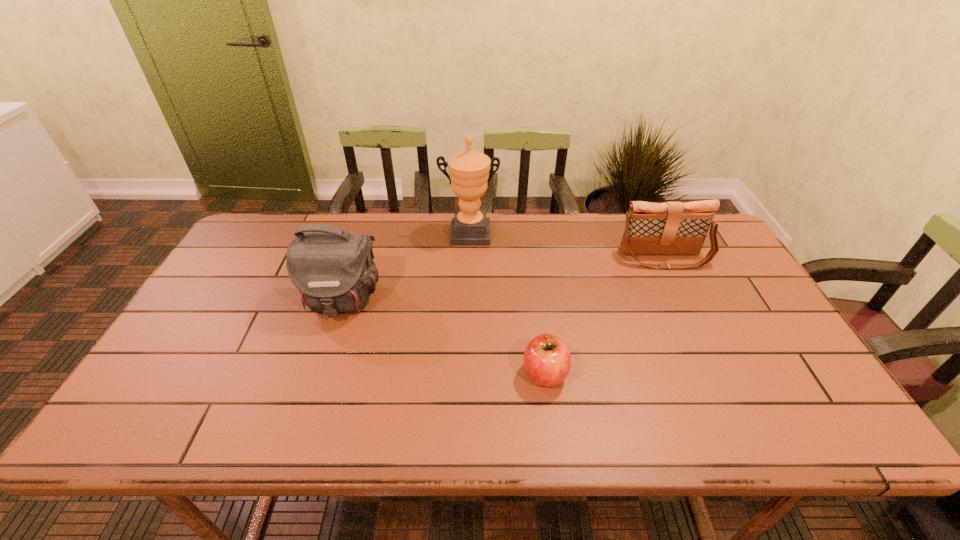
I want to click on vacant area that lies between the tallest object and the third shortest object, so click(x=405, y=267).

Find the location of a particular element. The image size is (960, 540). vacant space in between the third nearest object and the nearer shoulder bag is located at coordinates (502, 279).

Identify which object is located as the nearest to the second object from left to right. Please provide its 2D coordinates. Your answer should be formatted as a tuple, i.e. [(x, y)], where the tuple contains the x and y coordinates of a point satisfying the conditions above.

[(333, 269)]

Locate an element on the screen. object that is the second closest one to the shorter shoulder bag is located at coordinates (547, 360).

The width and height of the screenshot is (960, 540). I want to click on vacant space that satisfies the following two spatial constraints: 1. on the open flap of the nearest object; 2. on the left side of the taller shoulder bag, so click(x=317, y=374).

You are a GUI agent. You are given a task and a screenshot of the screen. Output one action in this format:
    pyautogui.click(x=<x>, y=<y>)
    Task: Click on the free location that satisfies the following two spatial constraints: 1. at the front of the farthest object with handles; 2. on the right side of the nearest object
    This screenshot has width=960, height=540.
    Given the screenshot: What is the action you would take?
    pyautogui.click(x=466, y=374)

Find the location of a particular element. The width and height of the screenshot is (960, 540). free space in the image that satisfies the following two spatial constraints: 1. on the open flap of the third shortest object; 2. on the left side of the apple is located at coordinates (317, 374).